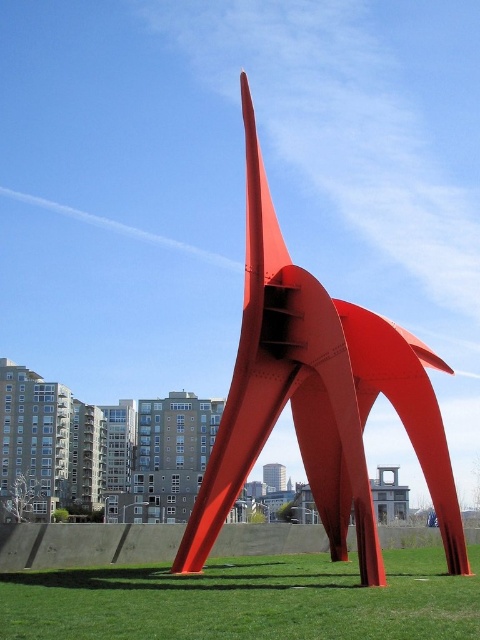
Between glossy steel sculpture at center and green grass at center, which one has more height?

With more height is glossy steel sculpture at center.

Does point (325, 456) lie behind point (272, 572)?

Yes, point (325, 456) is farther from viewer.

This screenshot has width=480, height=640. I want to click on glossy steel sculpture at center, so click(316, 396).